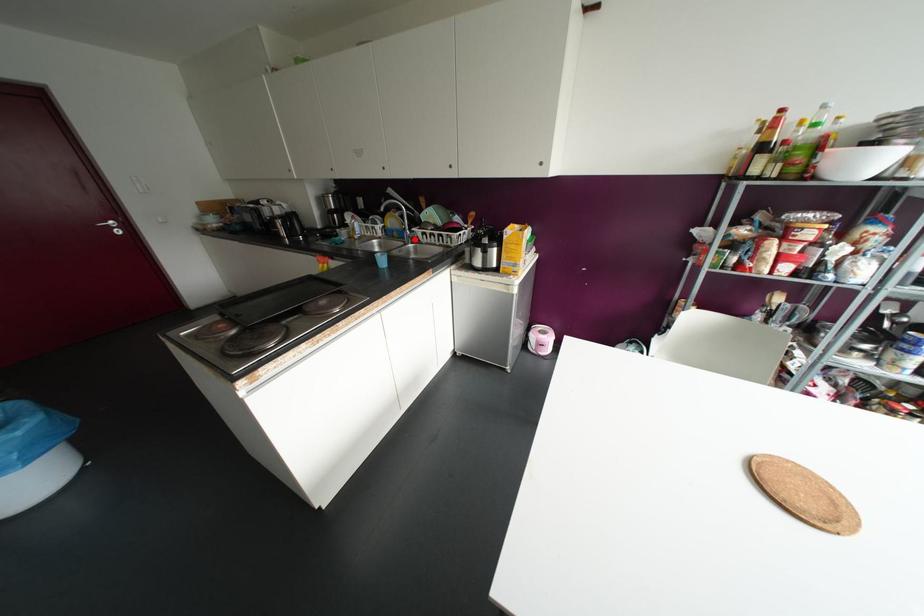
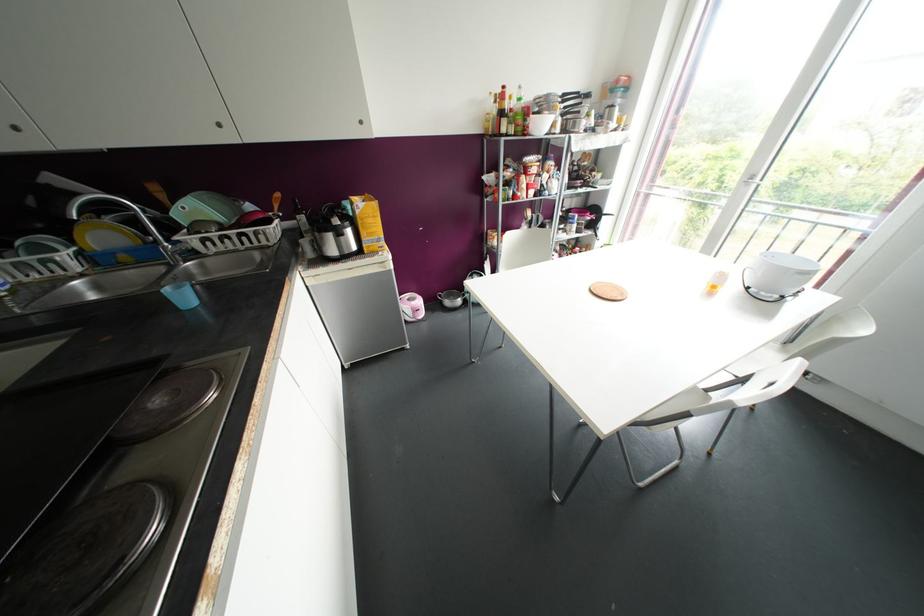
Find the pixel in the second image that matches the highlighted location in the first image.

(192, 253)